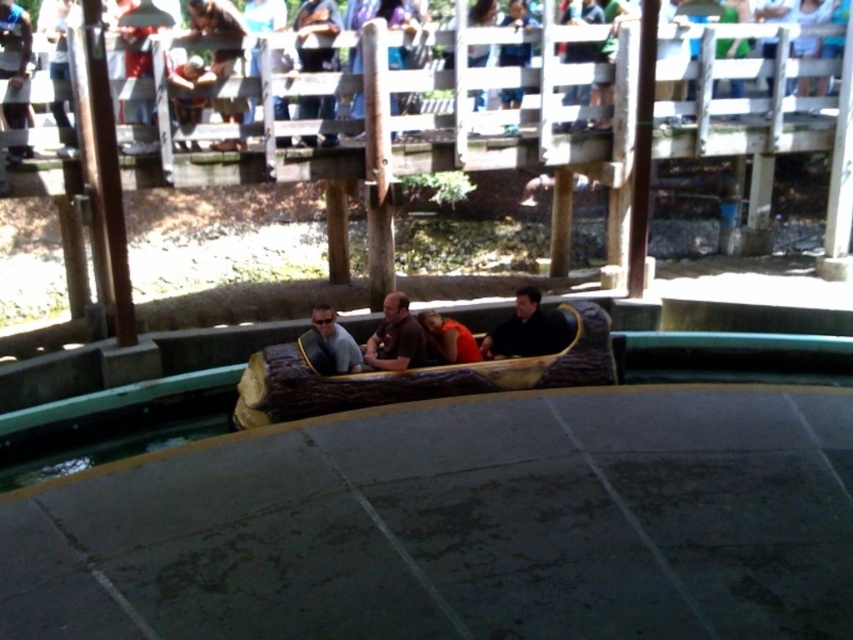
Question: Which object appears closest to the camera in this image?

Choices:
 (A) matte gray shirt at center
 (B) wooden log boat at center
 (C) orange fabric at center
 (D) brown leather jacket at center

Answer: (B)

Question: Is wooden log boat at center above matte gray shirt at center?

Choices:
 (A) yes
 (B) no

Answer: (B)

Question: Observing the image, what is the correct spatial positioning of wooden log boat at center in reference to black matte jacket at center?

Choices:
 (A) below
 (B) above

Answer: (A)

Question: Can you confirm if wooden log boat at center is positioned above orange fabric at center?

Choices:
 (A) no
 (B) yes

Answer: (A)

Question: Which point appears closest to the camera in this image?

Choices:
 (A) (523, 353)
 (B) (315, 369)
 (C) (337, 337)

Answer: (B)

Question: Estimate the real-world distances between objects in this image. Which object is farther from the black matte jacket at center?

Choices:
 (A) orange fabric at center
 (B) wooden log boat at center
 (C) brown leather jacket at center
 (D) matte gray shirt at center

Answer: (D)